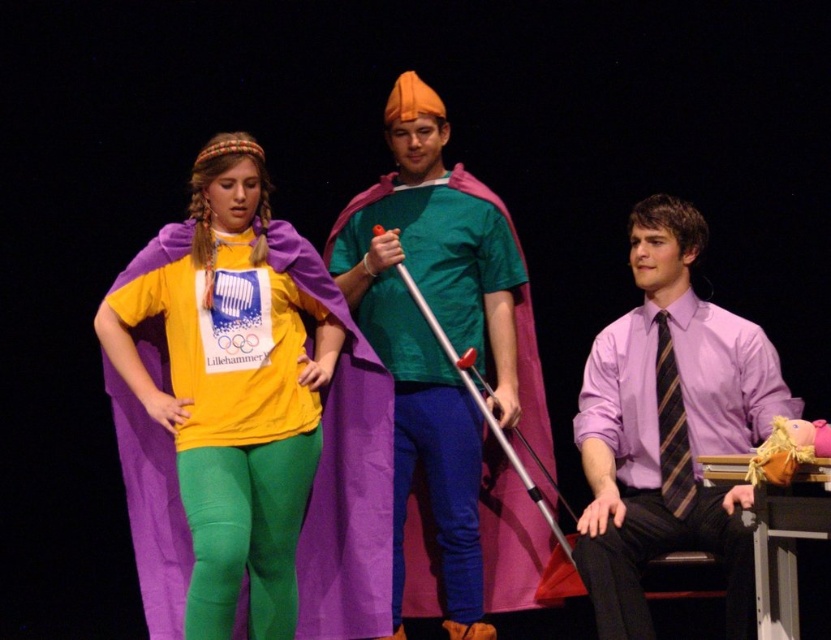
Can you confirm if purple silk shirt at right is smaller than striped silk tie at right?

Incorrect, purple silk shirt at right is not smaller in size than striped silk tie at right.

Locate an element on the screen. The width and height of the screenshot is (831, 640). purple silk shirt at right is located at coordinates (669, 428).

Measure the distance between point (765, 371) and camera.

Point (765, 371) is 12.26 feet away from camera.

Image resolution: width=831 pixels, height=640 pixels. In order to click on purple silk shirt at right in this screenshot , I will do `click(669, 428)`.

Is matte yellow t-shirt at center bigger than purple silk shirt at right?

No.

Is point (184, 376) behind point (743, 625)?

Yes, it is.

Find the location of a particular element. matte yellow t-shirt at center is located at coordinates (229, 385).

Who is higher up, matte yellow t-shirt at center or matte green t-shirt at center?

matte green t-shirt at center is higher up.

The width and height of the screenshot is (831, 640). I want to click on matte yellow t-shirt at center, so click(229, 385).